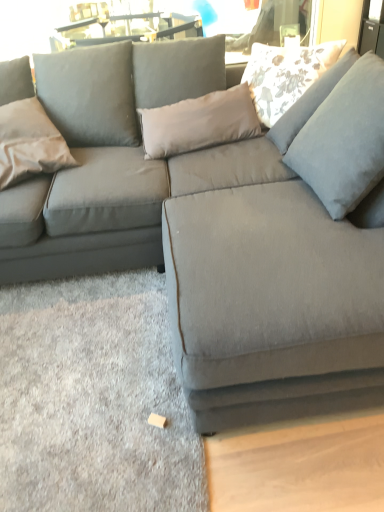
Image resolution: width=384 pixels, height=512 pixels. In order to click on floral fabric pillow at upper right, which is counted as the 1th pillow, starting from the top in this screenshot , I will do `click(285, 75)`.

This screenshot has height=512, width=384. What do you see at coordinates (285, 75) in the screenshot?
I see `floral fabric pillow at upper right, the first pillow when ordered from right to left` at bounding box center [285, 75].

Where is `satin beige pillow at left, the first pillow in the left-to-right sequence`? Image resolution: width=384 pixels, height=512 pixels. satin beige pillow at left, the first pillow in the left-to-right sequence is located at coordinates (29, 143).

Describe the element at coordinates (29, 143) in the screenshot. This screenshot has width=384, height=512. I see `satin beige pillow at left, the 2th pillow from the top` at that location.

In order to click on floral fabric pillow at upper right, the second pillow positioned from the left in this screenshot , I will do `click(285, 75)`.

Which is more to the right, floral fabric pillow at upper right, the 2th pillow ordered from the bottom, or satin beige pillow at left, positioned as the second pillow in right-to-left order?

floral fabric pillow at upper right, the 2th pillow ordered from the bottom.

Does floral fabric pillow at upper right, the 2th pillow ordered from the bottom, come in front of satin beige pillow at left, the first pillow in the left-to-right sequence?

No, floral fabric pillow at upper right, the 2th pillow ordered from the bottom, is behind satin beige pillow at left, the first pillow in the left-to-right sequence.

Is point (290, 71) closer to camera compared to point (40, 129)?

No, (290, 71) is behind (40, 129).

From the image's perspective, would you say floral fabric pillow at upper right, the second pillow positioned from the left, is positioned over satin beige pillow at left, acting as the first pillow starting from the bottom?

Yes, from the image's perspective, floral fabric pillow at upper right, the second pillow positioned from the left, is over satin beige pillow at left, acting as the first pillow starting from the bottom.

From a real-world perspective, is floral fabric pillow at upper right, the 2th pillow ordered from the bottom, located higher than satin beige pillow at left, positioned as the second pillow in right-to-left order?

Yes, from a real-world perspective, floral fabric pillow at upper right, the 2th pillow ordered from the bottom, is on top of satin beige pillow at left, positioned as the second pillow in right-to-left order.

Is floral fabric pillow at upper right, which is counted as the 1th pillow, starting from the top, wider than satin beige pillow at left, acting as the first pillow starting from the bottom?

Yes.

Considering the sizes of objects floral fabric pillow at upper right, the first pillow when ordered from right to left, and satin beige pillow at left, the 2th pillow from the top, in the image provided, who is taller, floral fabric pillow at upper right, the first pillow when ordered from right to left, or satin beige pillow at left, the 2th pillow from the top,?

satin beige pillow at left, the 2th pillow from the top, is taller.

Can you confirm if floral fabric pillow at upper right, the 2th pillow ordered from the bottom, is bigger than satin beige pillow at left, the first pillow in the left-to-right sequence?

Indeed, floral fabric pillow at upper right, the 2th pillow ordered from the bottom, has a larger size compared to satin beige pillow at left, the first pillow in the left-to-right sequence.

Which is correct: floral fabric pillow at upper right, which is counted as the 1th pillow, starting from the top, is inside satin beige pillow at left, acting as the first pillow starting from the bottom, or outside of it?

floral fabric pillow at upper right, which is counted as the 1th pillow, starting from the top, is not inside satin beige pillow at left, acting as the first pillow starting from the bottom, it's outside.

Can you see floral fabric pillow at upper right, which is counted as the 1th pillow, starting from the top, touching satin beige pillow at left, the first pillow in the left-to-right sequence?

They are not placed beside each other.

Could you tell me if floral fabric pillow at upper right, the first pillow when ordered from right to left, is turned towards satin beige pillow at left, the first pillow in the left-to-right sequence?

No, floral fabric pillow at upper right, the first pillow when ordered from right to left, is not turned towards satin beige pillow at left, the first pillow in the left-to-right sequence.

What's the angular difference between floral fabric pillow at upper right, which is counted as the 1th pillow, starting from the top, and satin beige pillow at left, acting as the first pillow starting from the bottom,'s facing directions?

floral fabric pillow at upper right, which is counted as the 1th pillow, starting from the top, and satin beige pillow at left, acting as the first pillow starting from the bottom, are facing 20.7 degrees away from each other.

In the scene shown: Could you measure the distance between floral fabric pillow at upper right, the 2th pillow ordered from the bottom, and satin beige pillow at left, acting as the first pillow starting from the bottom?

The distance of floral fabric pillow at upper right, the 2th pillow ordered from the bottom, from satin beige pillow at left, acting as the first pillow starting from the bottom, is 3.36 feet.

Where is `pillow below the floral fabric pillow at upper right, the first pillow when ordered from right to left (from a real-world perspective)`? pillow below the floral fabric pillow at upper right, the first pillow when ordered from right to left (from a real-world perspective) is located at coordinates (29, 143).

Considering the positions of objects satin beige pillow at left, acting as the first pillow starting from the bottom, and floral fabric pillow at upper right, which is counted as the 1th pillow, starting from the top, in the image provided, who is more to the right, satin beige pillow at left, acting as the first pillow starting from the bottom, or floral fabric pillow at upper right, which is counted as the 1th pillow, starting from the top,?

Positioned to the right is floral fabric pillow at upper right, which is counted as the 1th pillow, starting from the top.

Considering their positions, is satin beige pillow at left, the 2th pillow from the top, located in front of or behind floral fabric pillow at upper right, the first pillow when ordered from right to left?

satin beige pillow at left, the 2th pillow from the top, is in front of floral fabric pillow at upper right, the first pillow when ordered from right to left.

Is point (20, 104) positioned before point (251, 63)?

That is True.

From the image's perspective, which is above, satin beige pillow at left, positioned as the second pillow in right-to-left order, or floral fabric pillow at upper right, the 2th pillow ordered from the bottom?

floral fabric pillow at upper right, the 2th pillow ordered from the bottom, from the image's perspective.

From a real-world perspective, is satin beige pillow at left, the first pillow in the left-to-right sequence, above or below floral fabric pillow at upper right, which is counted as the 1th pillow, starting from the top?

From a real-world perspective, satin beige pillow at left, the first pillow in the left-to-right sequence, is physically below floral fabric pillow at upper right, which is counted as the 1th pillow, starting from the top.

Which of these two, satin beige pillow at left, the first pillow in the left-to-right sequence, or floral fabric pillow at upper right, the 2th pillow ordered from the bottom, is thinner?

satin beige pillow at left, the first pillow in the left-to-right sequence.

Is satin beige pillow at left, acting as the first pillow starting from the bottom, taller than floral fabric pillow at upper right, the first pillow when ordered from right to left?

Correct, satin beige pillow at left, acting as the first pillow starting from the bottom, is much taller as floral fabric pillow at upper right, the first pillow when ordered from right to left.

Between satin beige pillow at left, positioned as the second pillow in right-to-left order, and floral fabric pillow at upper right, the 2th pillow ordered from the bottom, which one has smaller size?

satin beige pillow at left, positioned as the second pillow in right-to-left order, is smaller.

Do you think satin beige pillow at left, the 2th pillow from the top, is within floral fabric pillow at upper right, the 2th pillow ordered from the bottom, or outside of it?

satin beige pillow at left, the 2th pillow from the top, is spatially situated outside floral fabric pillow at upper right, the 2th pillow ordered from the bottom.

Are satin beige pillow at left, positioned as the second pillow in right-to-left order, and floral fabric pillow at upper right, the first pillow when ordered from right to left, making contact?

No, satin beige pillow at left, positioned as the second pillow in right-to-left order, is not with floral fabric pillow at upper right, the first pillow when ordered from right to left.

Does satin beige pillow at left, positioned as the second pillow in right-to-left order, turn towards floral fabric pillow at upper right, the 2th pillow ordered from the bottom?

No, satin beige pillow at left, positioned as the second pillow in right-to-left order, is not turned towards floral fabric pillow at upper right, the 2th pillow ordered from the bottom.

How different are the orientations of satin beige pillow at left, the first pillow in the left-to-right sequence, and floral fabric pillow at upper right, the 2th pillow ordered from the bottom, in degrees?

There is a 20.7-degree angle between the facing directions of satin beige pillow at left, the first pillow in the left-to-right sequence, and floral fabric pillow at upper right, the 2th pillow ordered from the bottom.

Locate an element on the screen. Image resolution: width=384 pixels, height=512 pixels. pillow above the satin beige pillow at left, the first pillow in the left-to-right sequence (from the image's perspective) is located at coordinates (285, 75).

Identify the location of pillow that appears above the satin beige pillow at left, the 2th pillow from the top (from a real-world perspective). This screenshot has height=512, width=384. (285, 75).

The width and height of the screenshot is (384, 512). In order to click on pillow that is above the satin beige pillow at left, positioned as the second pillow in right-to-left order (from the image's perspective) in this screenshot , I will do `click(285, 75)`.